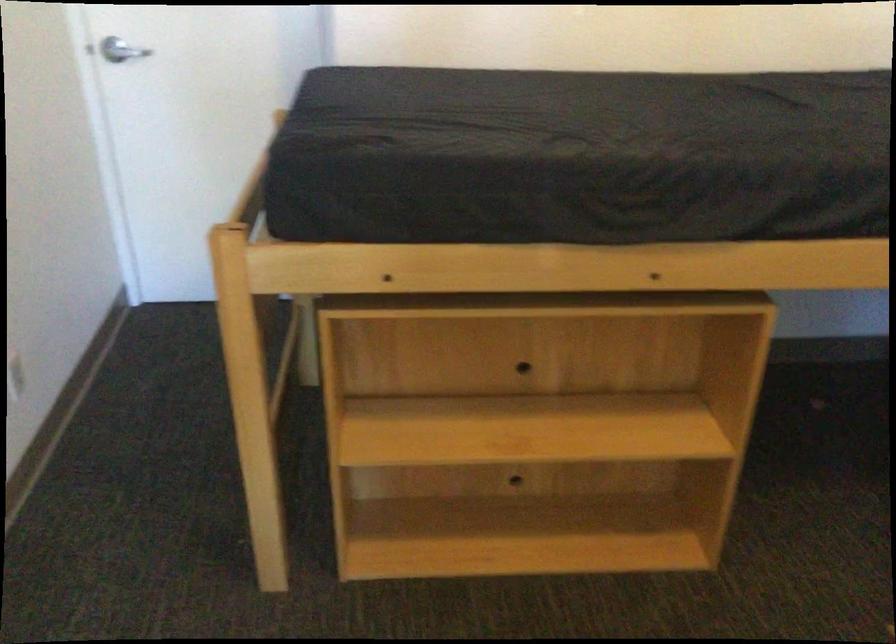
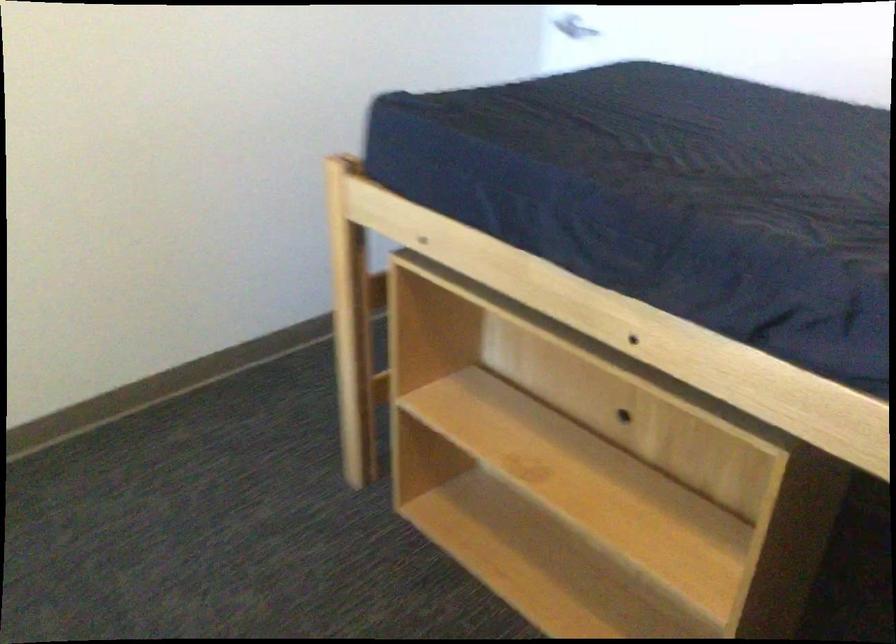
Find the pixel in the second image that matches (261,482) in the first image.

(377, 397)